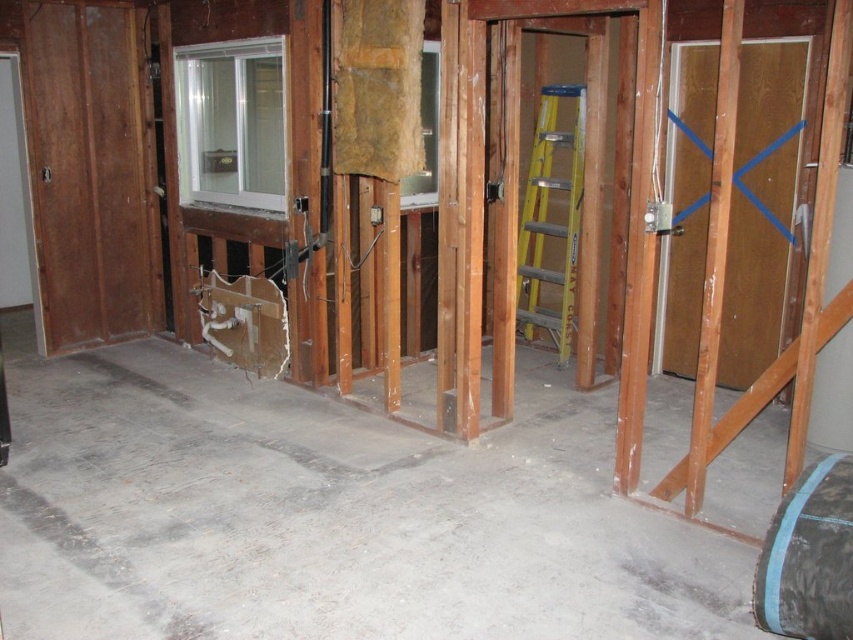
You are a construction worker holding a 2.5 meter long ladder. You need to place it between the point at (335, 568) and the point at (531, 248). Can the ladder fit diagonally between these two points without exceeding the space available?

Point (335, 568) is closer to the camera than point (531, 248). Since the ladder is 2.5 meters long, it can be placed diagonally between these two points as the distance between them is likely within the ladder length.